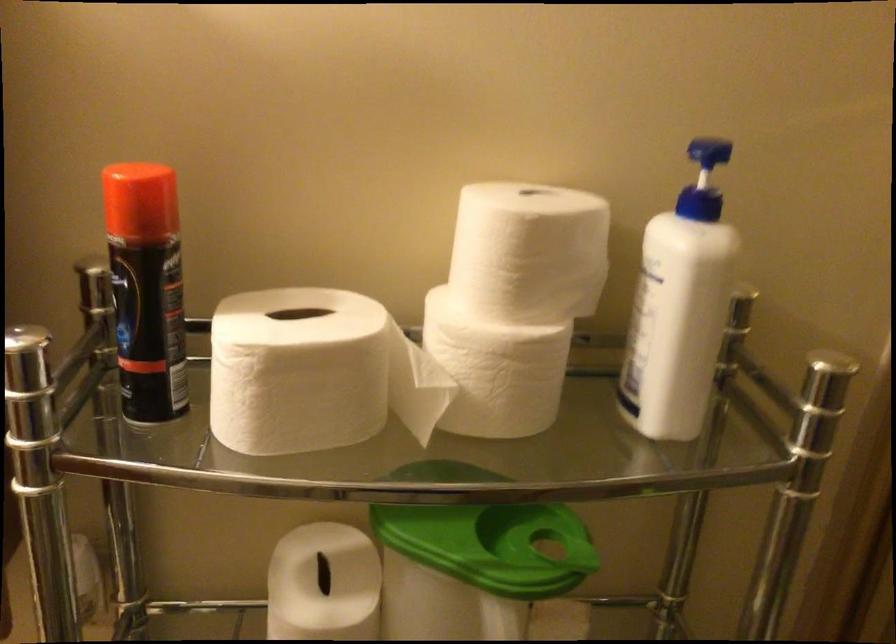
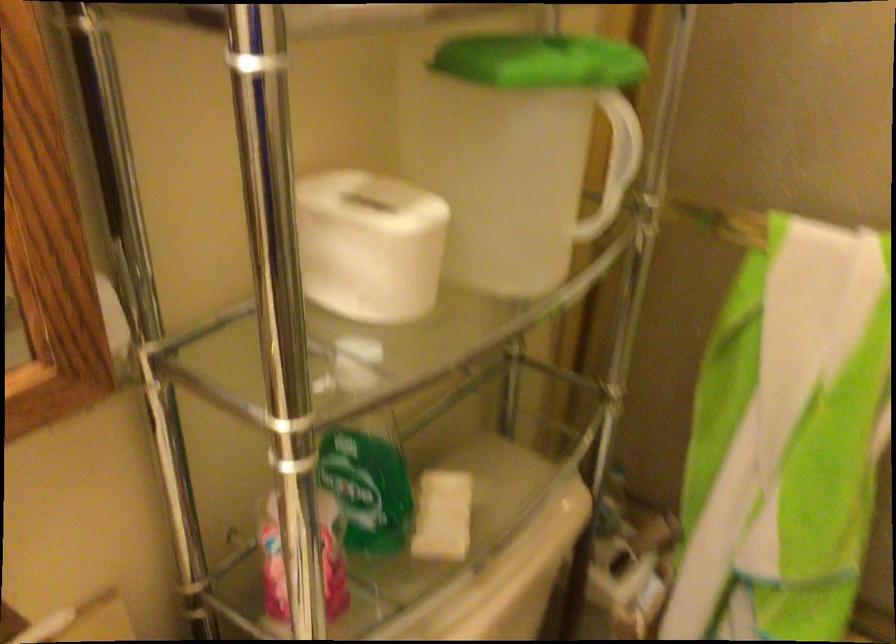
Find the pixel in the second image that matches (426,529) in the first image.

(539, 61)